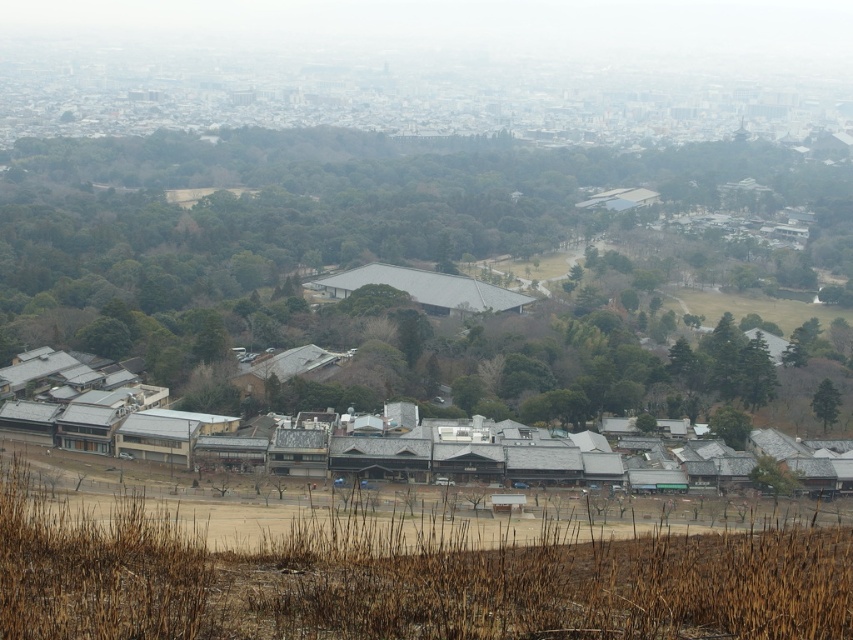
Question: Is gray concrete cityscape at upper center above gray shingled hut at center?

Choices:
 (A) no
 (B) yes

Answer: (B)

Question: Which point appears closest to the camera in this image?

Choices:
 (A) (126, 428)
 (B) (424, 275)
 (C) (339, 474)
 (D) (780, 109)

Answer: (C)

Question: Which of the following is the farthest from the observer?

Choices:
 (A) gray tile roof hut at center
 (B) gray metallic building at lower center
 (C) gray concrete cityscape at upper center

Answer: (C)

Question: Is gray concrete cityscape at upper center closer to the viewer compared to gray shingled hut at center?

Choices:
 (A) no
 (B) yes

Answer: (A)

Question: Is the position of gray concrete cityscape at upper center less distant than that of gray metallic building at lower center?

Choices:
 (A) no
 (B) yes

Answer: (A)

Question: Which point appears farthest from the camera in this image?

Choices:
 (A) (434, 273)
 (B) (152, 426)
 (C) (788, 116)
 (D) (387, 436)

Answer: (C)